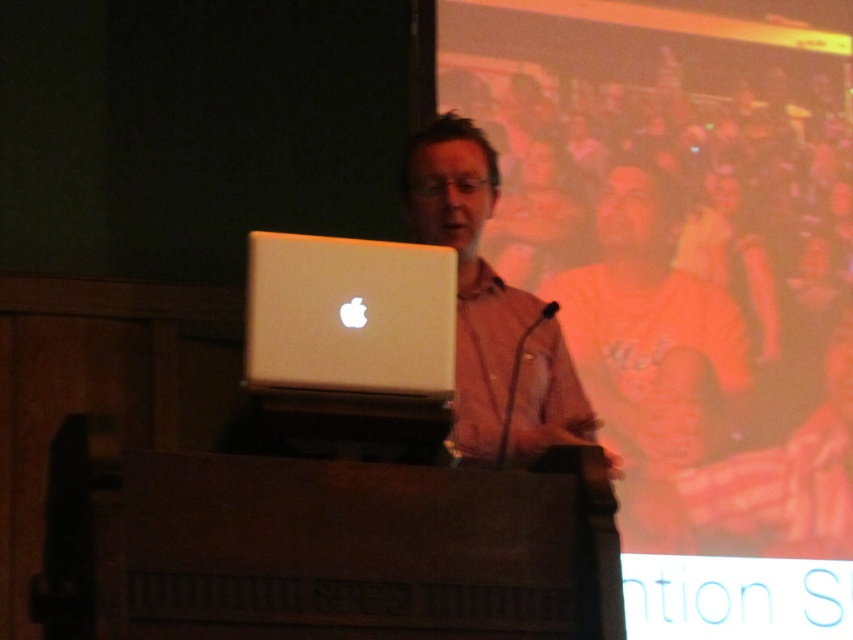
You are an event organizer setting up a presentation. You have two laptops on the podium. The silver metallic laptop at center and the matte white laptop at center. Which laptop is positioned to the left of the other?

The silver metallic laptop at center is positioned to the left of the matte white laptop at center.

You are an event organizer who needs to set up a presentation. You have two laptops, a silver metallic laptop at center and a matte white laptop at center. The presenter prefers using the laptop that is closer to him. Which laptop should you hand over to the presenter?

The silver metallic laptop at center is closer to the viewer than the matte white laptop at center, so the presenter should be handed the silver metallic laptop at center since it is closer to him.

You are an event organizer who needs to set up two laptops for a presentation. The silver metallic laptop at center and the matte white laptop at center must be arranged on a table. According to the scene, which laptop should be placed lower on the table?

The silver metallic laptop at center should be placed lower on the table because it is positioned below the matte white laptop at center in the scene.